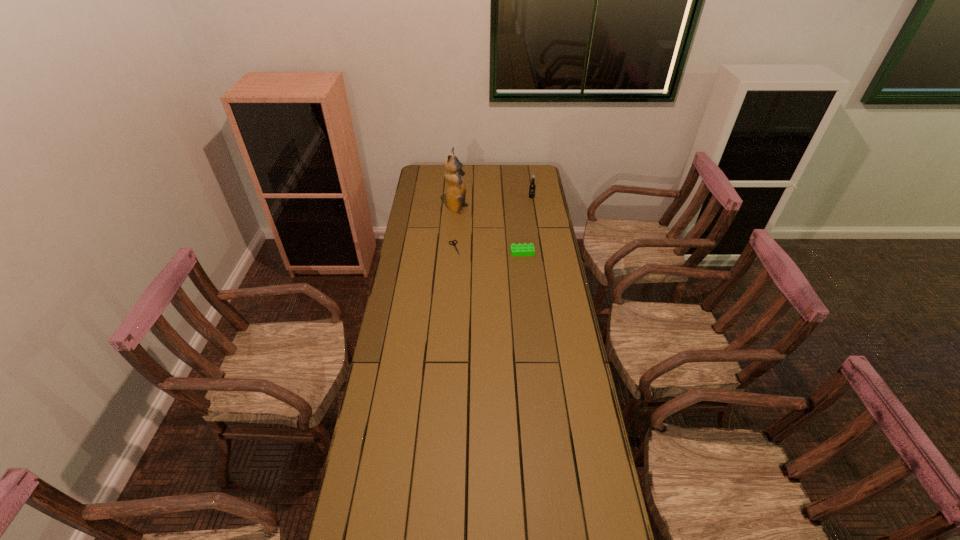
Where is `vacant area located on the front of the shortest object`? The image size is (960, 540). vacant area located on the front of the shortest object is located at coordinates tap(450, 315).

Find the location of a particular element. The height and width of the screenshot is (540, 960). root beer located at the right edge is located at coordinates (532, 186).

This screenshot has height=540, width=960. I want to click on Lego at the right edge, so click(519, 249).

This screenshot has width=960, height=540. Find the location of `vacant region at the far edge of the desktop`. vacant region at the far edge of the desktop is located at coordinates coord(515,186).

Image resolution: width=960 pixels, height=540 pixels. I want to click on vacant space at the left edge of the desktop, so click(x=420, y=291).

Locate an element on the screen. free region at the right edge of the desktop is located at coordinates click(x=540, y=320).

The width and height of the screenshot is (960, 540). What are the coordinates of `free space at the far left corner of the desktop` in the screenshot? It's located at (418, 168).

This screenshot has width=960, height=540. In order to click on free space between the farthest object and the second object from right to left in this screenshot , I will do `click(527, 225)`.

Where is `free spot between the root beer and the shears`? This screenshot has width=960, height=540. free spot between the root beer and the shears is located at coordinates pyautogui.click(x=492, y=222).

Locate an element on the screen. Image resolution: width=960 pixels, height=540 pixels. free area in between the cat and the rightmost object is located at coordinates pos(494,204).